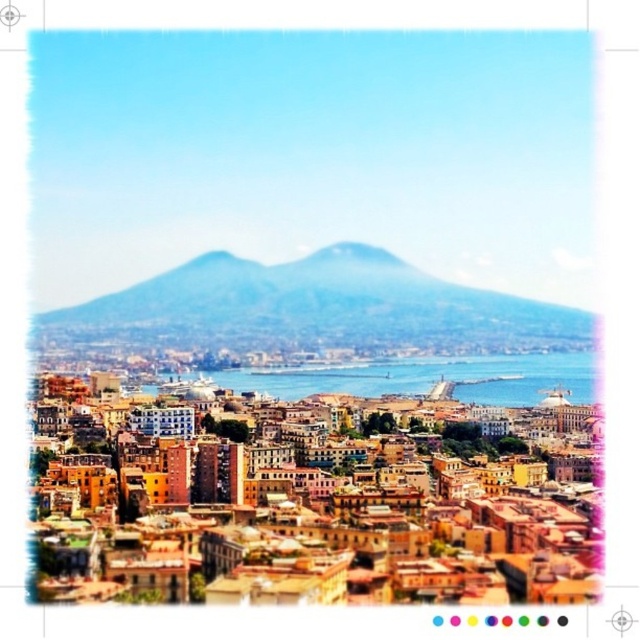
Image resolution: width=640 pixels, height=640 pixels. In order to click on blue foggy mountain at center in this screenshot , I will do `click(314, 308)`.

Which is more to the right, blue foggy mountain at center or blue water at center?

blue water at center

Describe the element at coordinates (314, 308) in the screenshot. Image resolution: width=640 pixels, height=640 pixels. I see `blue foggy mountain at center` at that location.

Identify the location of blue foggy mountain at center. (314, 308).